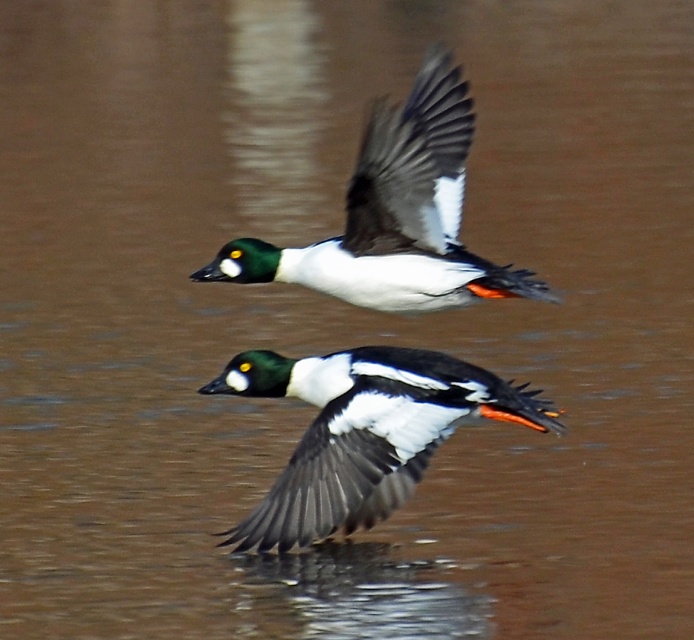
Question: Can you confirm if shiny black duck at center is thinner than shiny black duck at upper center?

Choices:
 (A) no
 (B) yes

Answer: (A)

Question: Does shiny black duck at center come behind shiny black duck at upper center?

Choices:
 (A) yes
 (B) no

Answer: (A)

Question: Considering the relative positions of shiny black duck at center and shiny black duck at upper center in the image provided, where is shiny black duck at center located with respect to shiny black duck at upper center?

Choices:
 (A) right
 (B) left

Answer: (B)

Question: Which point is closer to the camera taking this photo?

Choices:
 (A) (282, 266)
 (B) (405, 374)

Answer: (B)